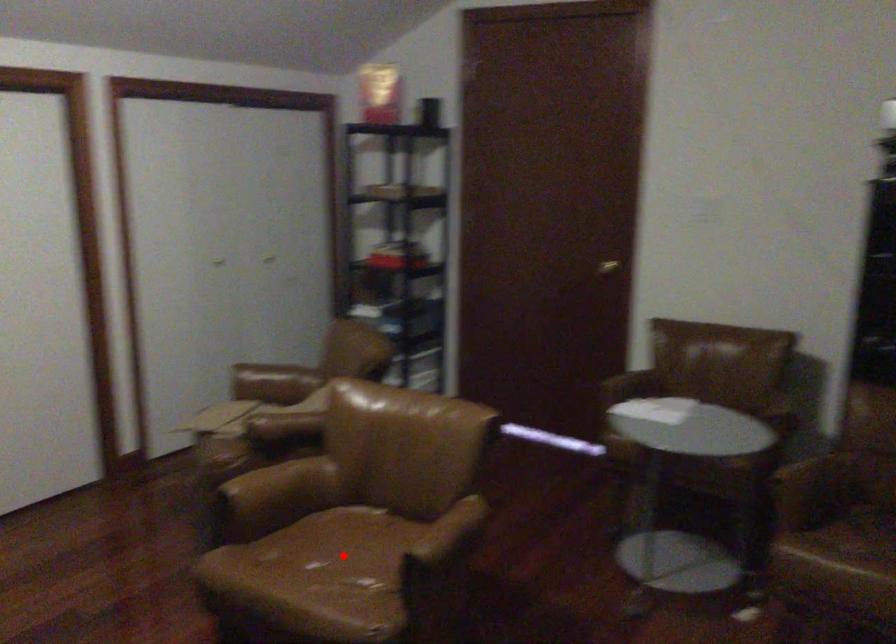
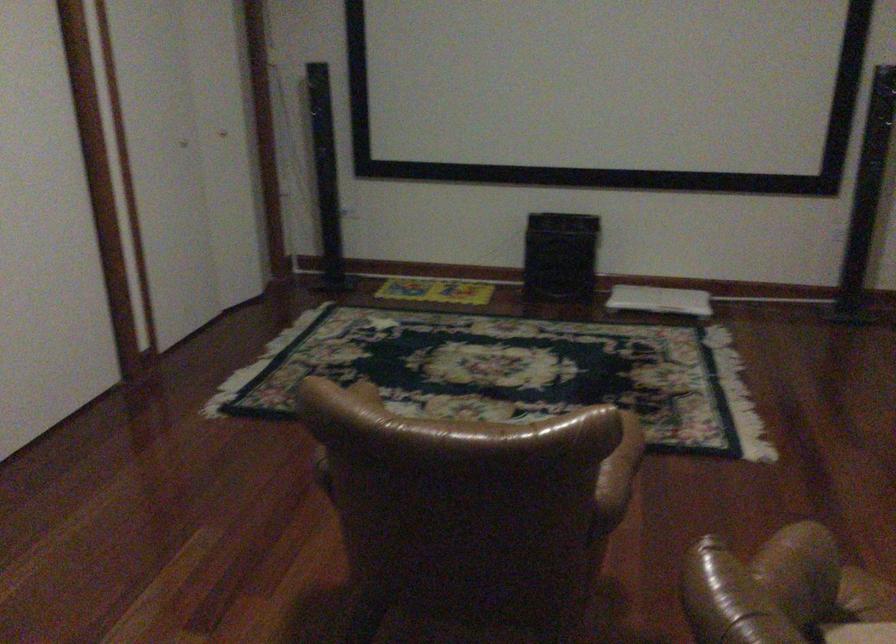
Question: I am providing you with two images of the same scene from different viewpoints. A red point is marked on the first image. Can you still see the location of the red point in image 2?

Choices:
 (A) Yes
 (B) No

Answer: (B)